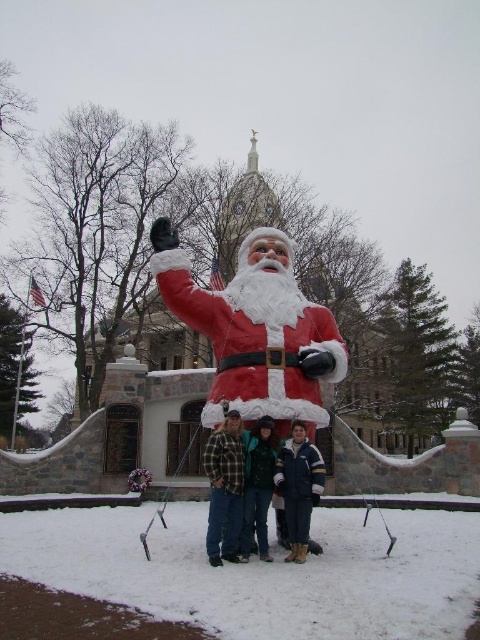
Between white fluffy snow at lower center and matte red santa at center, which one appears on the right side from the viewer's perspective?

matte red santa at center is more to the right.

Can you confirm if white fluffy snow at lower center is thinner than matte red santa at center?

In fact, white fluffy snow at lower center might be wider than matte red santa at center.

Image resolution: width=480 pixels, height=640 pixels. I want to click on white fluffy snow at lower center, so click(263, 572).

Between matte red santa at center and flannel shirt at center, which one appears on the right side from the viewer's perspective?

From the viewer's perspective, matte red santa at center appears more on the right side.

Who is positioned more to the left, matte red santa at center or flannel shirt at center?

From the viewer's perspective, flannel shirt at center appears more on the left side.

Is point (228, 488) closer to viewer compared to point (237, 449)?

Yes, point (228, 488) is closer to viewer.

In order to click on matte red santa at center in this screenshot , I will do `click(240, 483)`.

Does point (423, 566) come farther from viewer compared to point (170, 232)?

No, (423, 566) is in front of (170, 232).

What are the coordinates of `white fluffy snow at lower center` in the screenshot? It's located at (263, 572).